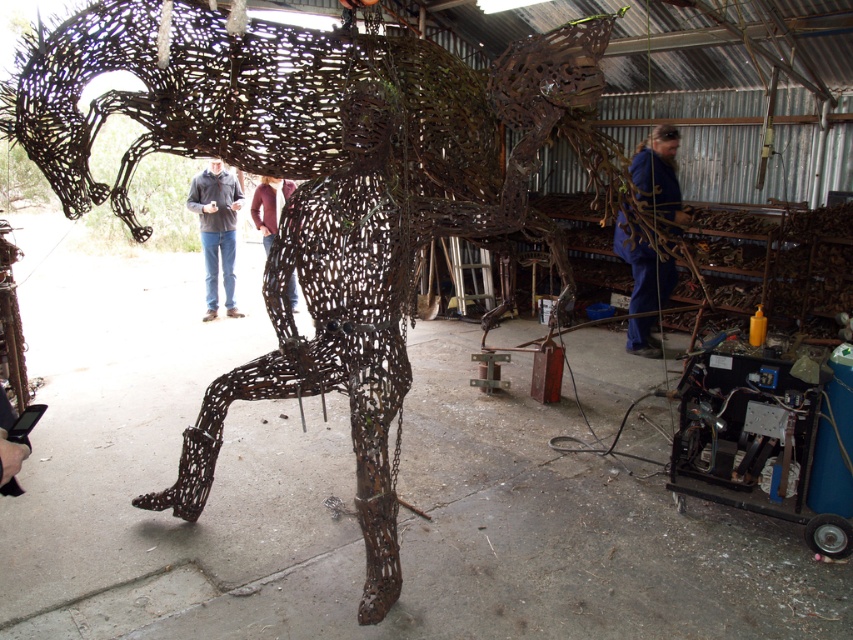
Looking at this image, you are a visitor in the workshop and want to take a photo of the rustic wire horse at center without any obstructions. Considering the current positioning of the matte black jacket at center, is there anything you need to do before taking the photo?

The matte black jacket at center is in front of the rustic wire horse at center, so you need to ask the person wearing the matte black jacket at center to move out of the way to avoid blocking the view of the rustic wire horse at center.